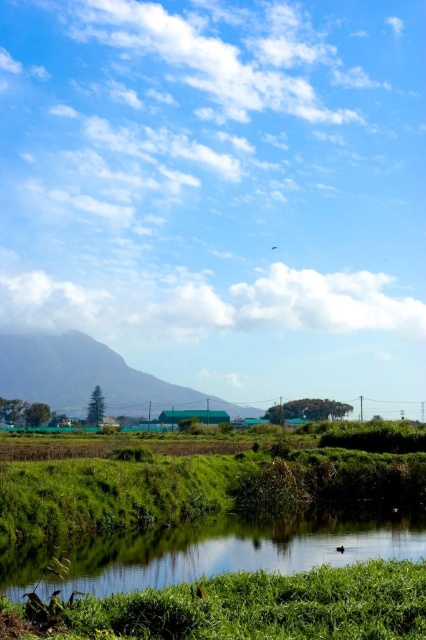
Can you confirm if green grass at lower center is smaller than green grassy stream at lower center?

Correct, green grass at lower center occupies less space than green grassy stream at lower center.

Which is in front, point (313, 600) or point (322, 524)?

Point (313, 600) is more forward.

Is point (328, 618) positioned before point (203, 548)?

Yes, it is in front of point (203, 548).

Find the location of a particular element. Image resolution: width=426 pixels, height=640 pixels. green grass at lower center is located at coordinates point(270,605).